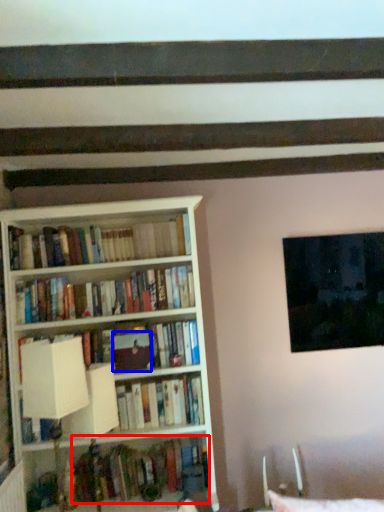
Question: Which object appears closest to the camera in this image, book (highlighted by a red box) or paperback book (highlighted by a blue box)?

Choices:
 (A) book
 (B) paperback book

Answer: (A)